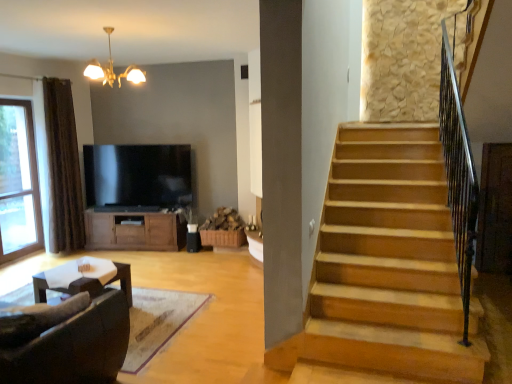
This screenshot has height=384, width=512. What are the coordinates of `vacant region above gold metallic chandelier at upper center (from a real-world perspective)` in the screenshot? It's located at (116, 29).